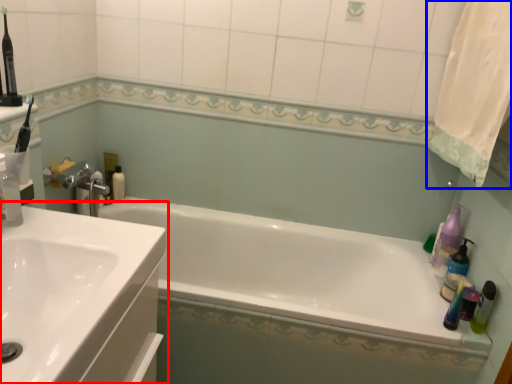
Question: Which of the following is the farthest to the observer, sink (highlighted by a red box) or shower curtain (highlighted by a blue box)?

Choices:
 (A) sink
 (B) shower curtain

Answer: (B)